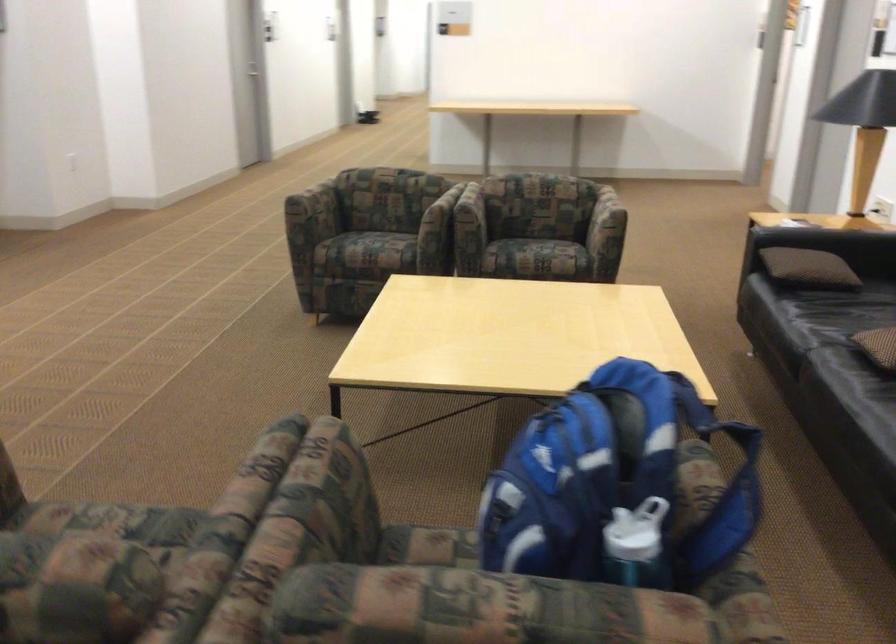
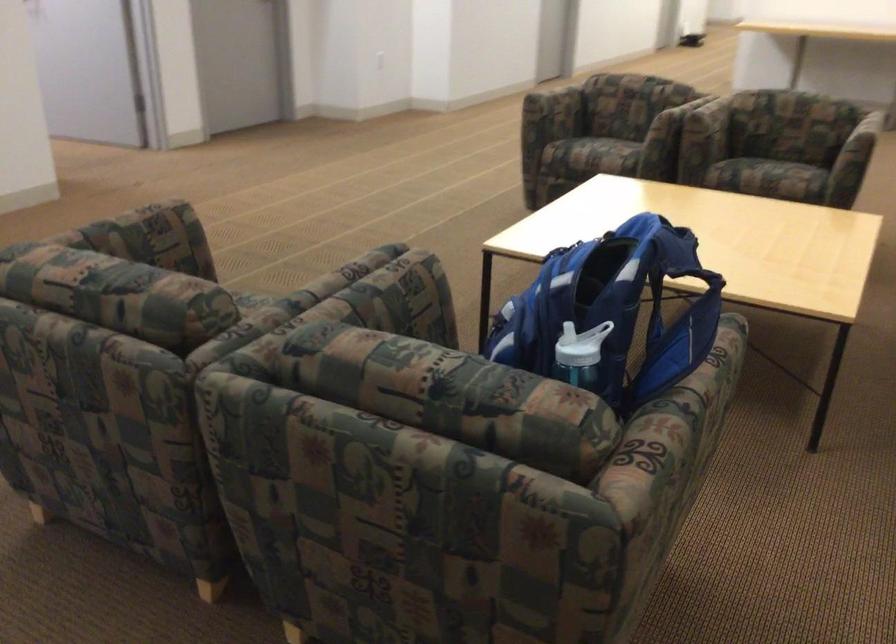
Locate, in the second image, the point that corresponds to point (91, 512) in the first image.

(250, 298)